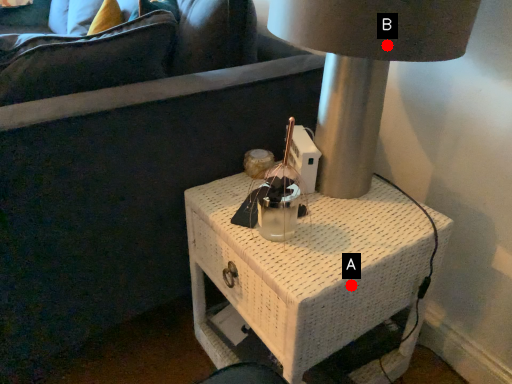
Question: Two points are circled on the image, labeled by A and B beside each circle. Among these points, which one is farthest from the camera?

Choices:
 (A) A is further
 (B) B is further

Answer: (A)